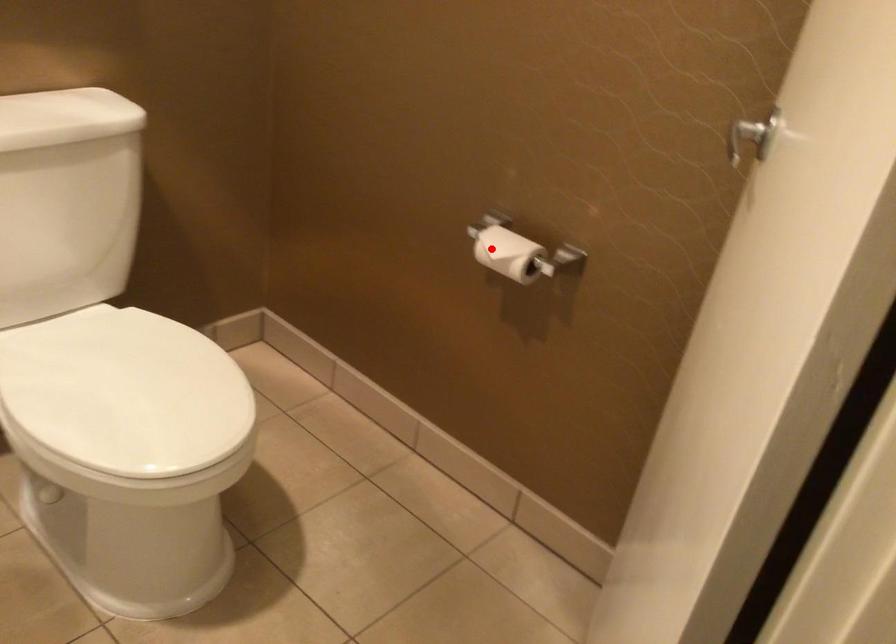
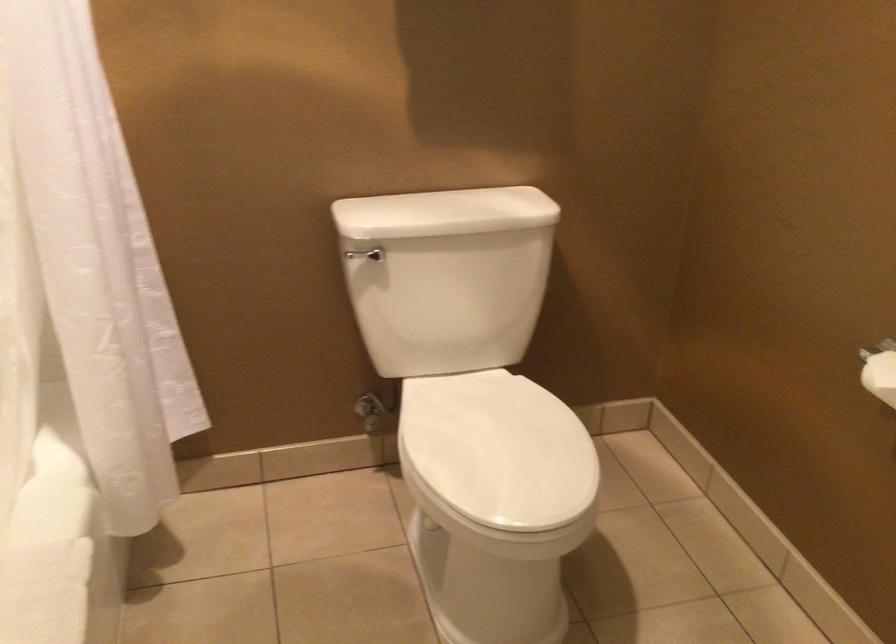
Question: I am providing you with two images of the same scene from different viewpoints. In image1, a red point is highlighted. Considering the same 3D point in image2, which of the following is correct?

Choices:
 (A) It is closer
 (B) It is farther

Answer: (A)